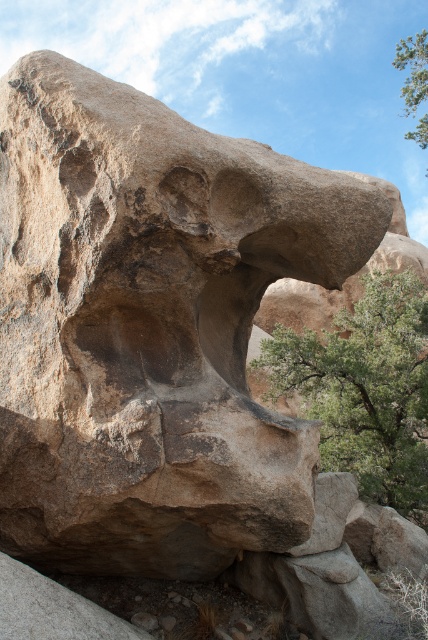
How much distance is there between green leafy tree at center and green leafy tree at upper right?

20.97 feet

Is green leafy tree at center closer to the viewer compared to green leafy tree at upper right?

Yes, green leafy tree at center is in front of green leafy tree at upper right.

Who is more distant from viewer, (338, 336) or (409, 136)?

Positioned behind is point (409, 136).

This screenshot has height=640, width=428. What are the coordinates of `green leafy tree at center` in the screenshot? It's located at (365, 388).